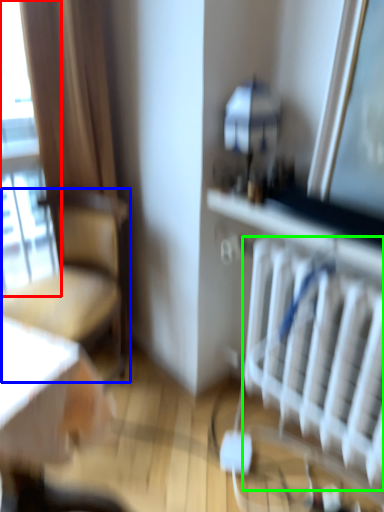
Question: Estimate the real-world distances between objects in this image. Which object is farther from window (highlighted by a red box), chair (highlighted by a blue box) or radiator (highlighted by a green box)?

Choices:
 (A) chair
 (B) radiator

Answer: (B)